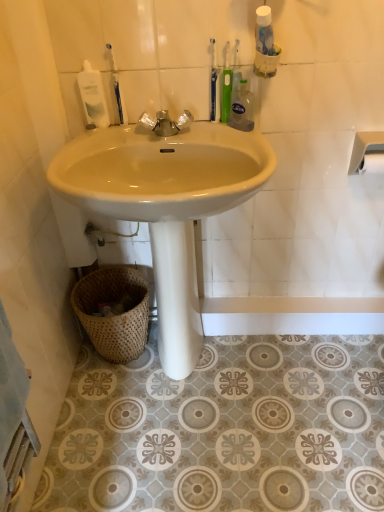
Where is `vacant space that's between matte silver faucet at center and green plastic toothbrush at upper center, the third toothbrush when ordered from left to right`? vacant space that's between matte silver faucet at center and green plastic toothbrush at upper center, the third toothbrush when ordered from left to right is located at coordinates (202, 131).